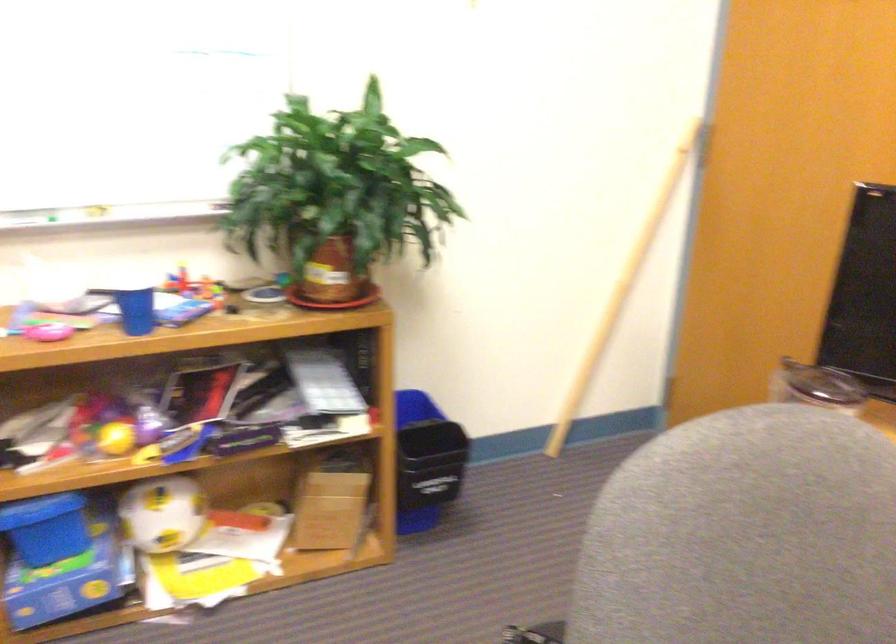
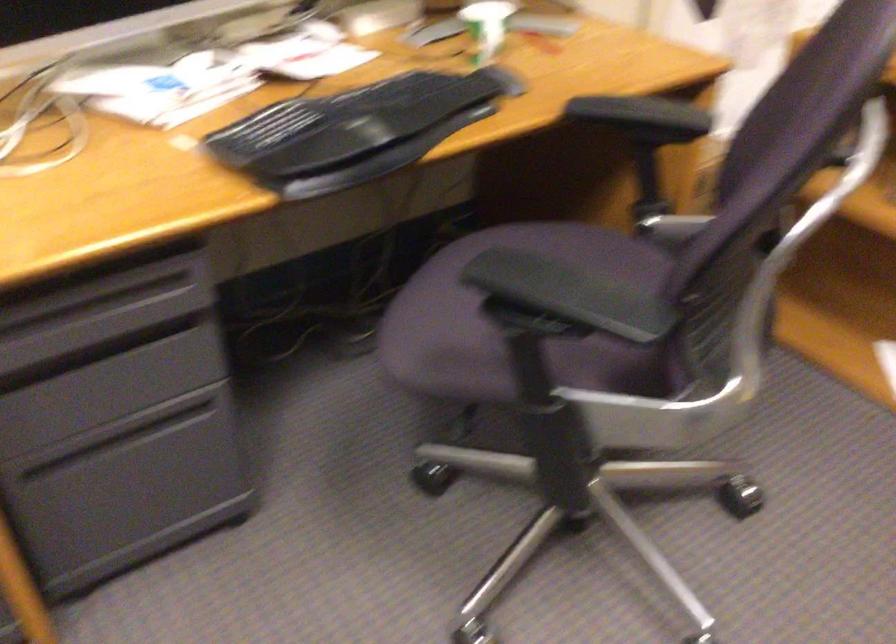
Based on the continuous images, in which direction is the camera rotating?

The camera's rotation is toward left-down.